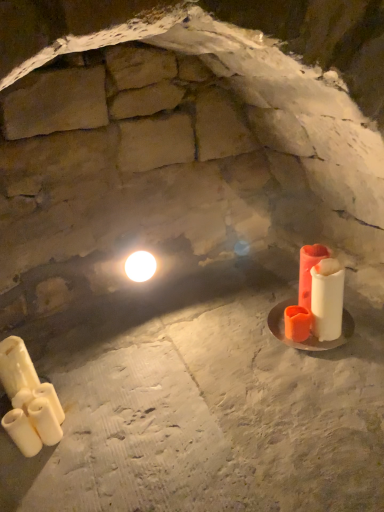
Question: Is white matte candle at lower left, positioned as the second candle in right-to-left order, thinner than white glossy light bulb at upper center?

Choices:
 (A) yes
 (B) no

Answer: (A)

Question: Is white matte candle at lower left, positioned as the second candle in right-to-left order, smaller than white glossy light bulb at upper center?

Choices:
 (A) no
 (B) yes

Answer: (B)

Question: Is white matte candle at lower left, the fourth candle from the left, next to white glossy light bulb at upper center?

Choices:
 (A) yes
 (B) no

Answer: (B)

Question: Is white matte candle at lower left, positioned as the second candle in right-to-left order, taller than white glossy light bulb at upper center?

Choices:
 (A) yes
 (B) no

Answer: (A)

Question: Does white matte candle at lower left, positioned as the second candle in right-to-left order, have a greater width compared to white glossy light bulb at upper center?

Choices:
 (A) no
 (B) yes

Answer: (A)

Question: Does point (127, 267) appear closer or farther from the camera than point (317, 245)?

Choices:
 (A) farther
 (B) closer

Answer: (A)

Question: Considering their positions, is white glossy light bulb at upper center located in front of or behind matte orange candle at right, acting as the 5th candle starting from the left?

Choices:
 (A) behind
 (B) front

Answer: (A)

Question: In the image, is white glossy light bulb at upper center on the left side or the right side of matte orange candle at right, acting as the first candle starting from the right?

Choices:
 (A) left
 (B) right

Answer: (A)

Question: Is white glossy light bulb at upper center situated inside matte orange candle at right, acting as the 5th candle starting from the left, or outside?

Choices:
 (A) outside
 (B) inside

Answer: (A)

Question: Is white glossy light bulb at upper center bigger or smaller than white matte candle at lower left, placed as the 3th candle when sorted from left to right?

Choices:
 (A) big
 (B) small

Answer: (A)

Question: Based on their positions, is white glossy light bulb at upper center located to the left or right of white matte candle at lower left, which is the 3th candle in right-to-left order?

Choices:
 (A) right
 (B) left

Answer: (A)

Question: From the image's perspective, relative to white matte candle at lower left, placed as the 3th candle when sorted from left to right, is white glossy light bulb at upper center above or below?

Choices:
 (A) above
 (B) below

Answer: (A)

Question: Looking at their shapes, would you say white glossy light bulb at upper center is wider or thinner than white matte candle at lower left, which is the 3th candle in right-to-left order?

Choices:
 (A) wide
 (B) thin

Answer: (A)

Question: In the image, is white matte candle at lower left, placed as the 3th candle when sorted from left to right, positioned in front of or behind matte orange candle at right, acting as the 5th candle starting from the left?

Choices:
 (A) behind
 (B) front

Answer: (B)

Question: Does point (59, 418) appear closer or farther from the camera than point (309, 307)?

Choices:
 (A) farther
 (B) closer

Answer: (B)